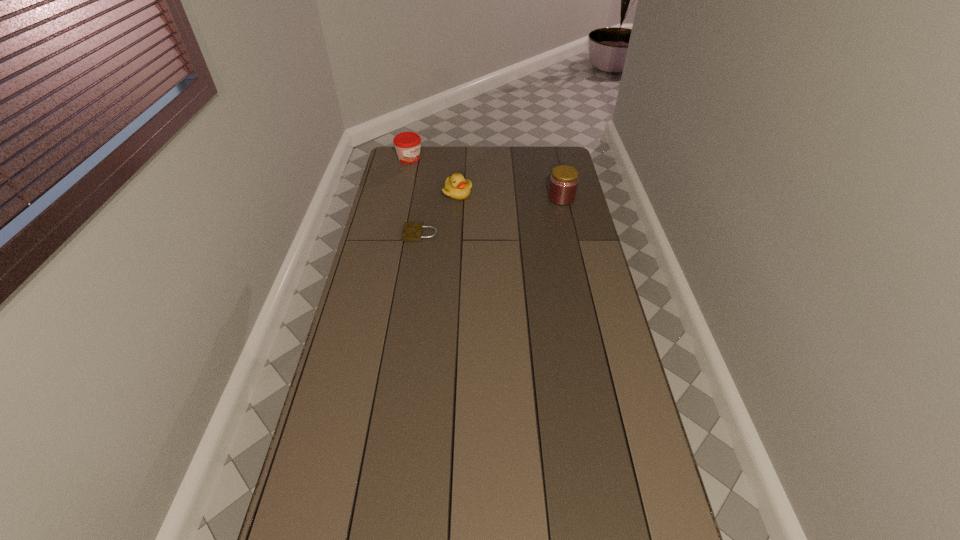
Find the location of a particular element. The image size is (960, 540). vacant space that is in between the second object from right to left and the nearest object is located at coordinates (439, 214).

At what (x,y) coordinates should I click in order to perform the action: click on free spot between the padlock and the shorter jam. Please return your answer as a coordinate pair (x, y). This screenshot has width=960, height=540. Looking at the image, I should click on (415, 196).

Find the location of `free space between the shortest object and the second object from right to left`. free space between the shortest object and the second object from right to left is located at coordinates (439, 214).

This screenshot has width=960, height=540. I want to click on free space between the rightmost object and the duckling, so click(510, 195).

Find the location of a particular element. The image size is (960, 540). object that stands as the third closest to the shortest object is located at coordinates pyautogui.click(x=563, y=184).

Where is `object that stands as the closest to the left jam`? This screenshot has width=960, height=540. object that stands as the closest to the left jam is located at coordinates (456, 187).

You are a GUI agent. You are given a task and a screenshot of the screen. Output one action in this format:
    pyautogui.click(x=<x>, y=<y>)
    Task: Click on the vacant region that satisfies the following two spatial constraints: 1. on the front side of the shortest object; 2. on the keyhole side of the shorter jam
    
    Given the screenshot: What is the action you would take?
    pyautogui.click(x=393, y=234)